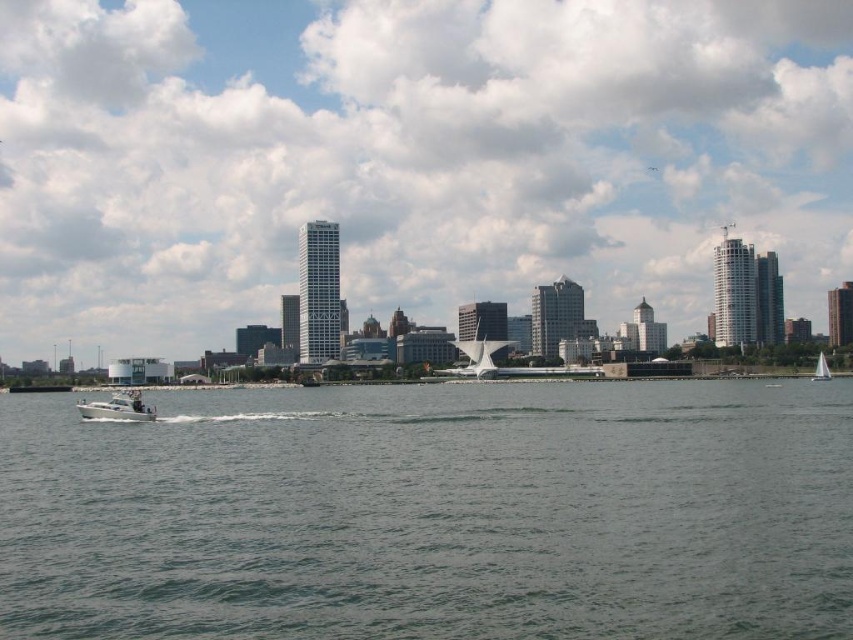
Is greenish-blue water at center further to the viewer compared to white glossy motorboat at lower left?

That is False.

Can you confirm if greenish-blue water at center is positioned to the right of white glossy motorboat at lower left?

Yes, greenish-blue water at center is to the right of white glossy motorboat at lower left.

Does point (511, 624) lie in front of point (131, 388)?

Yes, it is.

You are a GUI agent. You are given a task and a screenshot of the screen. Output one action in this format:
    pyautogui.click(x=<x>, y=<y>)
    Task: Click on the greenish-blue water at center
    
    Given the screenshot: What is the action you would take?
    pyautogui.click(x=433, y=513)

Which is more to the left, matte glass skyscrapers at center or white sailboat at lower right?

matte glass skyscrapers at center is more to the left.

Can you confirm if matte glass skyscrapers at center is bigger than white sailboat at lower right?

Indeed, matte glass skyscrapers at center has a larger size compared to white sailboat at lower right.

Locate an element on the screen. matte glass skyscrapers at center is located at coordinates pyautogui.click(x=408, y=157).

Locate an element on the screen. matte glass skyscrapers at center is located at coordinates (408, 157).

Between matte glass skyscrapers at center and white glossy motorboat at lower left, which one is positioned higher?

matte glass skyscrapers at center is higher up.

Based on the photo, measure the distance between point (361,136) and camera.

Point (361,136) is 344.89 meters from camera.

Is point (91, 312) positioned before point (119, 403)?

No, it is not.

Identify the location of matte glass skyscrapers at center. This screenshot has width=853, height=640. (408, 157).